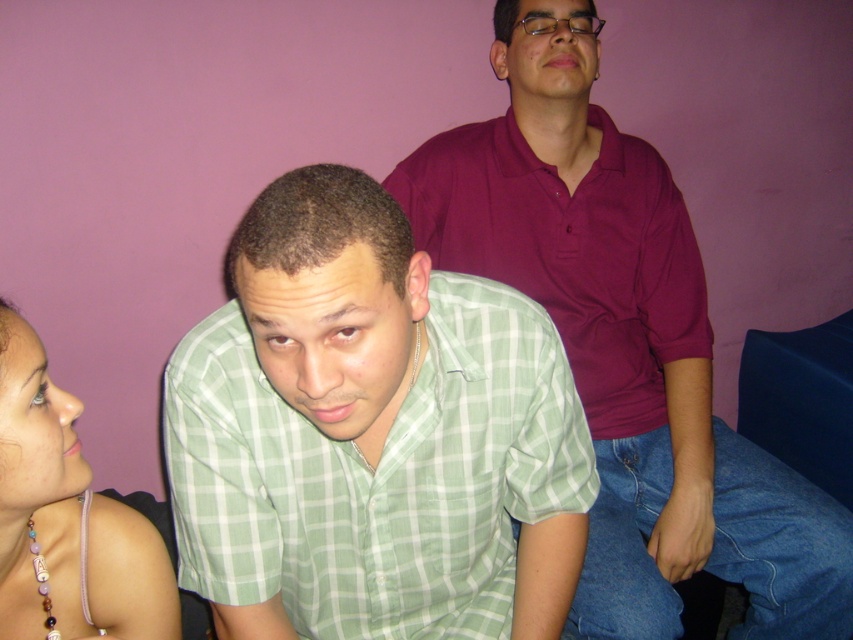
You are standing in a room and want to hand a document to the person wearing the maroon cotton shirt at upper center. If you can reach up to 2 meters, can you reach them without moving?

The maroon cotton shirt at upper center and viewer are 4.69 feet apart from each other. Since 4.69 feet is approximately 1.43 meters, which is within your 2 meter reach, you can reach them without moving.